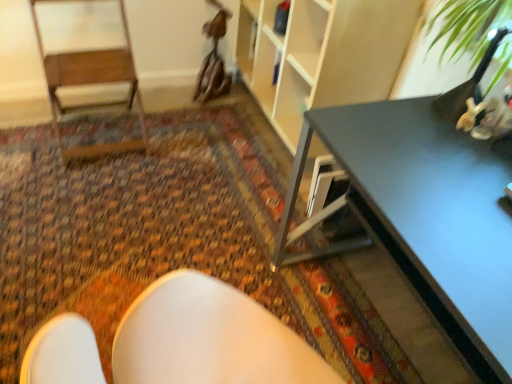
I want to click on vacant region below carpeted floor at center (from a real-world perspective), so click(159, 211).